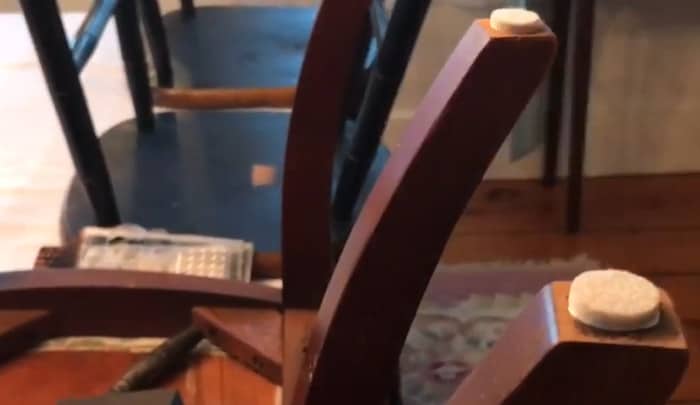
Identify the location of brown chair leg. The image size is (700, 405). (402, 235), (524, 351), (304, 150).